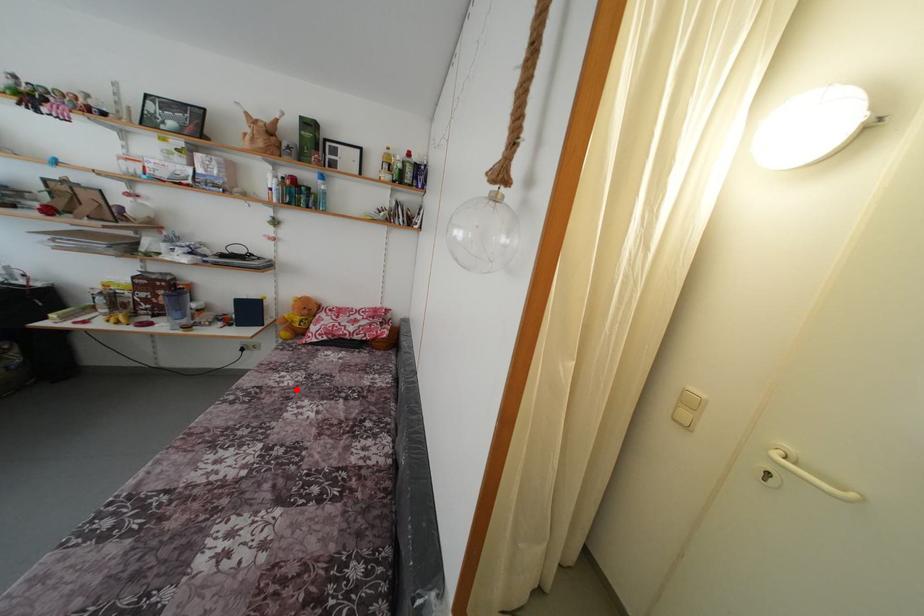
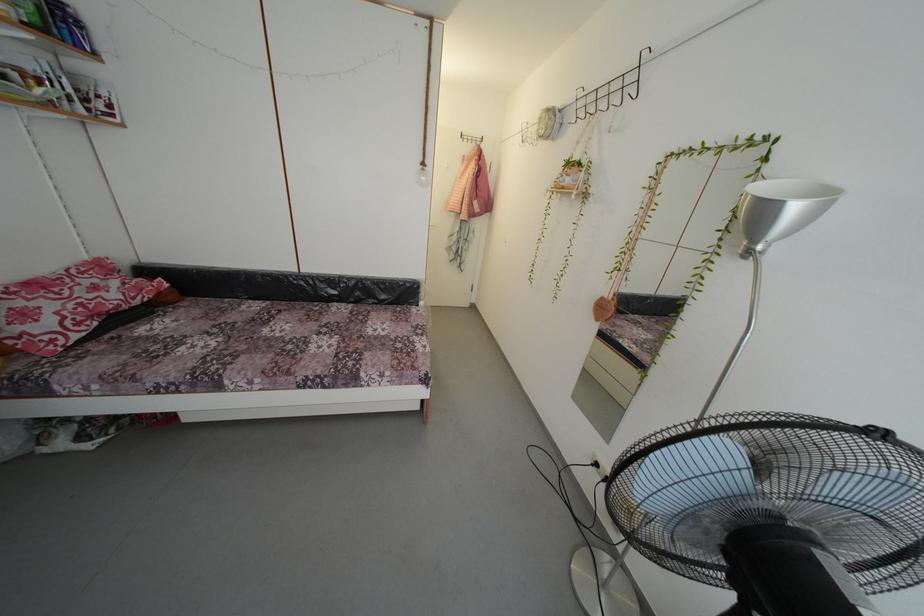
Where in the second image is the point corresponding to the highlighted location from the first image?

(225, 345)